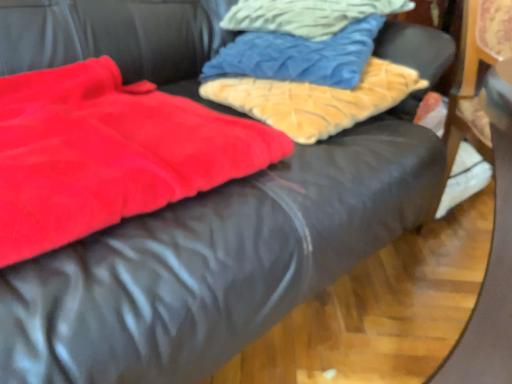
Question: Is fuzzy beige pillow at upper center, the 1th cloth from the bottom, positioned beyond the bounds of velvet blue pillow at upper center, positioned as the first cloth in top-to-bottom order?

Choices:
 (A) no
 (B) yes

Answer: (B)

Question: Could you tell me if fuzzy beige pillow at upper center, the third cloth from the top, is facing velvet blue pillow at upper center, positioned as the first cloth in top-to-bottom order?

Choices:
 (A) yes
 (B) no

Answer: (B)

Question: Considering the relative sizes of fuzzy beige pillow at upper center, the third cloth from the top, and velvet blue pillow at upper center, positioned as the first cloth in top-to-bottom order, in the image provided, is fuzzy beige pillow at upper center, the third cloth from the top, wider than velvet blue pillow at upper center, positioned as the first cloth in top-to-bottom order,?

Choices:
 (A) yes
 (B) no

Answer: (A)

Question: From a real-world perspective, is fuzzy beige pillow at upper center, the third cloth from the top, below velvet blue pillow at upper center, which is the third cloth in bottom-to-top order?

Choices:
 (A) yes
 (B) no

Answer: (A)

Question: From the image's perspective, is fuzzy beige pillow at upper center, the 1th cloth from the bottom, beneath velvet blue pillow at upper center, positioned as the first cloth in top-to-bottom order?

Choices:
 (A) no
 (B) yes

Answer: (B)

Question: Looking at their shapes, would you say velvety red blanket at left is wider or thinner than velvet blue pillow at upper center, positioned as the first cloth in top-to-bottom order?

Choices:
 (A) thin
 (B) wide

Answer: (B)

Question: Is velvety red blanket at left taller or shorter than velvet blue pillow at upper center, positioned as the first cloth in top-to-bottom order?

Choices:
 (A) tall
 (B) short

Answer: (A)

Question: Based on their sizes in the image, would you say velvety red blanket at left is bigger or smaller than velvet blue pillow at upper center, positioned as the first cloth in top-to-bottom order?

Choices:
 (A) big
 (B) small

Answer: (A)

Question: From the image's perspective, is velvety red blanket at left above or below velvet blue pillow at upper center, which is the third cloth in bottom-to-top order?

Choices:
 (A) below
 (B) above

Answer: (A)

Question: Would you say velvety red blanket at left is to the left or to the right of fuzzy beige pillow at upper center, the 1th cloth from the bottom, in the picture?

Choices:
 (A) right
 (B) left

Answer: (B)

Question: Considering the positions of point (31, 201) and point (253, 109), is point (31, 201) closer or farther from the camera than point (253, 109)?

Choices:
 (A) farther
 (B) closer

Answer: (B)

Question: From the image's perspective, is velvety red blanket at left positioned above or below fuzzy beige pillow at upper center, the third cloth from the top?

Choices:
 (A) above
 (B) below

Answer: (B)

Question: Is velvety red blanket at left bigger or smaller than fuzzy beige pillow at upper center, the third cloth from the top?

Choices:
 (A) small
 (B) big

Answer: (B)

Question: From a real-world perspective, relative to velvety red blanket at left, is velvet blue pillow at upper center, the 2th cloth from the top, vertically above or below?

Choices:
 (A) above
 (B) below

Answer: (A)

Question: Which is correct: velvet blue pillow at upper center, the 2th cloth from the top, is inside velvety red blanket at left, or outside of it?

Choices:
 (A) inside
 (B) outside

Answer: (B)